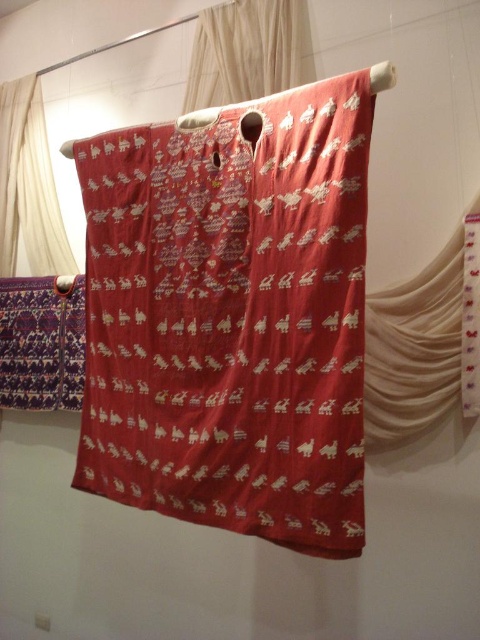
You are an interior designer planning to hang two decorative items in a room. You have the silky red fabric at center and the silky white curtain at left. Based on their sizes, which one would you recommend placing in a wider space to accommodate its dimensions?

The silky red fabric at center has a greater width than the silky white curtain at left, so it should be placed in a wider space to accommodate its dimensions.

You are a visitor in the museum and want to compare the two white curtains. Which one is thinner between the matte white curtain at right and the silky white curtain at left?

The matte white curtain at right is thinner than the silky white curtain at left.

You are standing in front of a traditional textile exhibition. There is a point marked at coordinates point (429,417). If you want to touch this point on the textile, will you be able to reach it if your arm can extend 5 feet? Please consider the distance between you and the point.

The point (429,417) is 5.28 feet away from the viewer. Since your arm can only extend 5 feet, you cannot reach it.